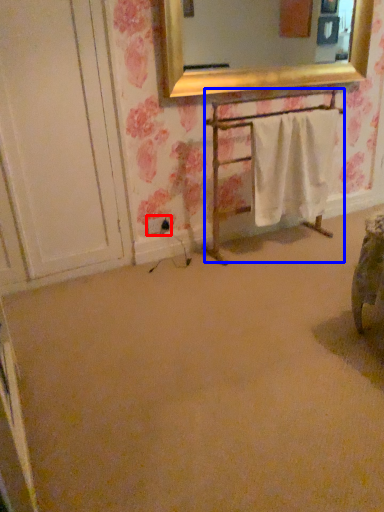
Question: Which object is further to the camera taking this photo, electric outlet (highlighted by a red box) or furniture (highlighted by a blue box)?

Choices:
 (A) electric outlet
 (B) furniture

Answer: (A)